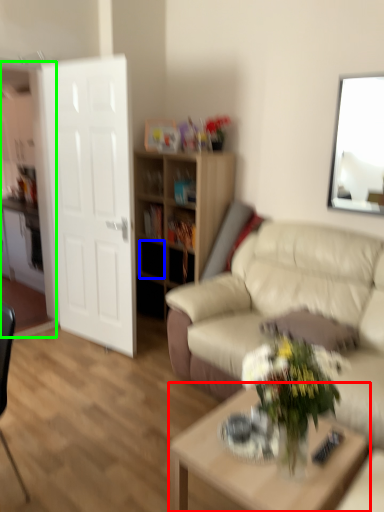
Question: Which is nearer to the coffee table (highlighted by a red box)? drawer (highlighted by a blue box) or entertainment center (highlighted by a green box).

Choices:
 (A) drawer
 (B) entertainment center

Answer: (A)